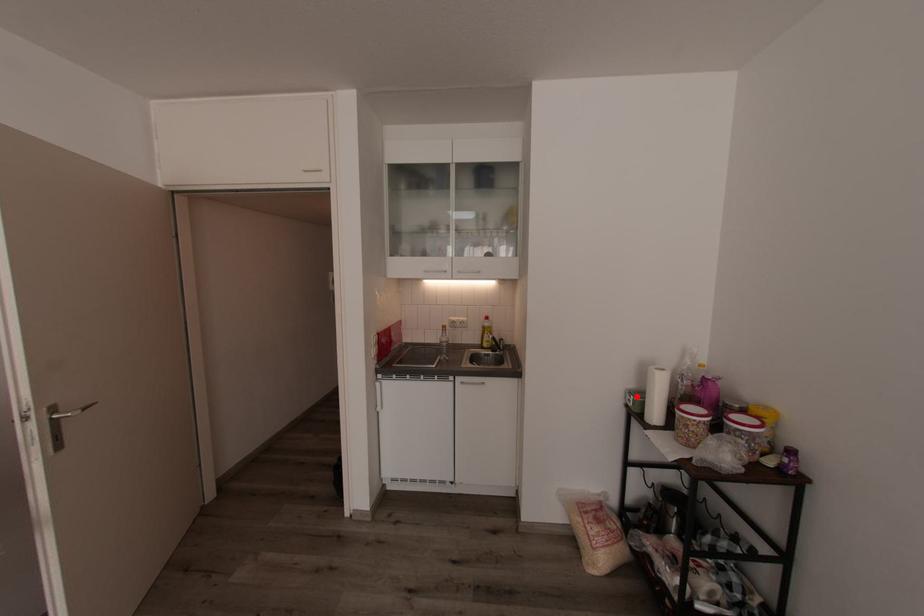
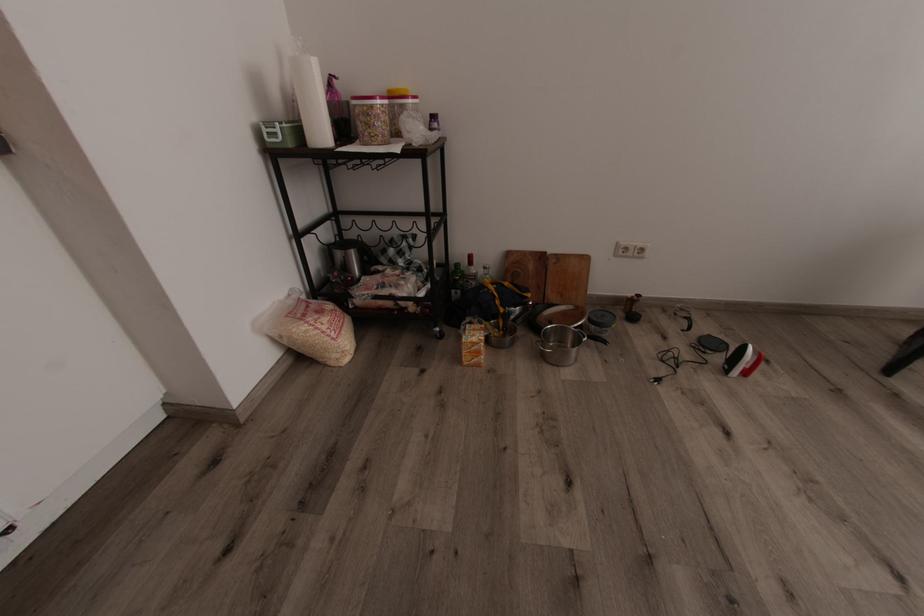
In the second image, find the point that corresponds to the highlighted location in the first image.

(282, 123)